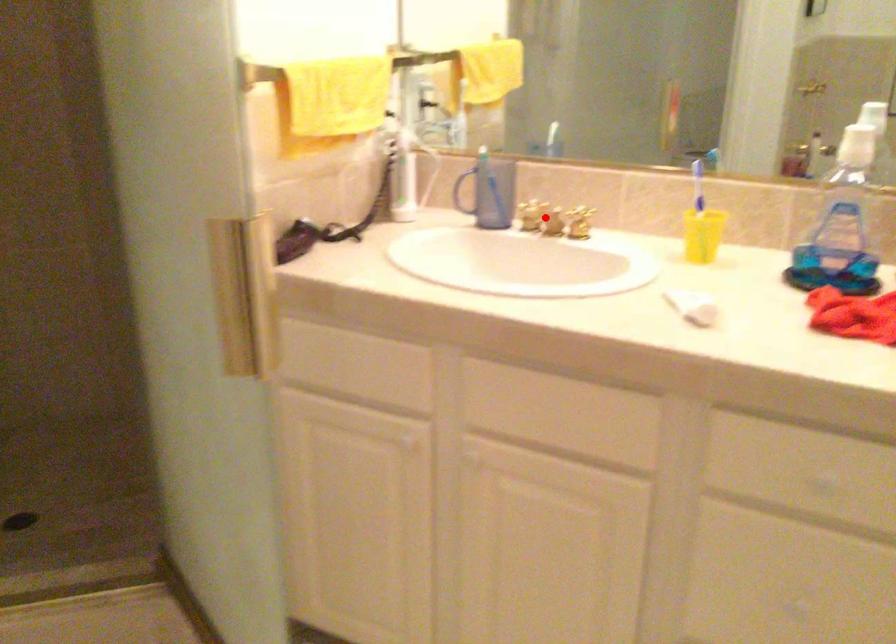
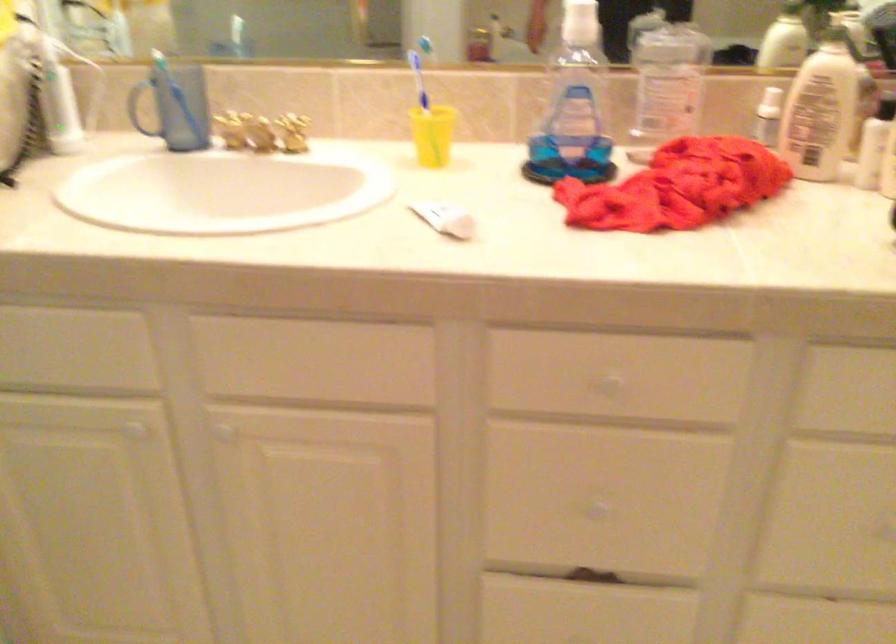
Question: I am providing you with two images of the same scene from different viewpoints. Given a red point in image1, look at the same physical point in image2. Is it:

Choices:
 (A) Closer to the viewpoint
 (B) Farther from the viewpoint

Answer: (A)